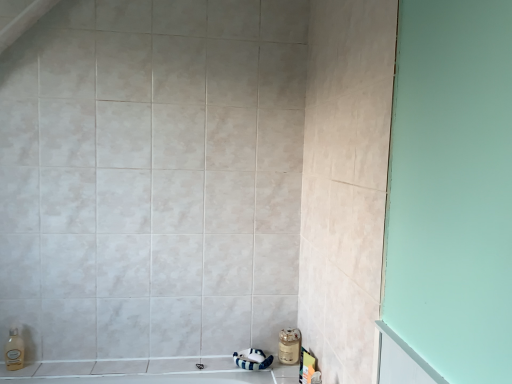
Question: Could you tell me if metallic gold jar at lower right is facing translucent plastic soap dispenser at lower left?

Choices:
 (A) yes
 (B) no

Answer: (B)

Question: Would you consider metallic gold jar at lower right to be distant from translucent plastic soap dispenser at lower left?

Choices:
 (A) no
 (B) yes

Answer: (B)

Question: Is metallic gold jar at lower right surrounding translucent plastic soap dispenser at lower left?

Choices:
 (A) yes
 (B) no

Answer: (B)

Question: From the image's perspective, does metallic gold jar at lower right appear lower than translucent plastic soap dispenser at lower left?

Choices:
 (A) yes
 (B) no

Answer: (A)

Question: Is metallic gold jar at lower right bigger than translucent plastic soap dispenser at lower left?

Choices:
 (A) yes
 (B) no

Answer: (A)

Question: Can you confirm if metallic gold jar at lower right is positioned to the right of translucent plastic soap dispenser at lower left?

Choices:
 (A) yes
 (B) no

Answer: (A)

Question: Considering the relative sizes of translucent plastic soap dispenser at lower left and metallic gold jar at lower right in the image provided, is translucent plastic soap dispenser at lower left wider than metallic gold jar at lower right?

Choices:
 (A) no
 (B) yes

Answer: (A)

Question: Is translucent plastic soap dispenser at lower left thinner than metallic gold jar at lower right?

Choices:
 (A) no
 (B) yes

Answer: (B)

Question: Is metallic gold jar at lower right at the back of translucent plastic soap dispenser at lower left?

Choices:
 (A) no
 (B) yes

Answer: (A)

Question: Does translucent plastic soap dispenser at lower left have a larger size compared to metallic gold jar at lower right?

Choices:
 (A) no
 (B) yes

Answer: (A)

Question: Is translucent plastic soap dispenser at lower left directly adjacent to metallic gold jar at lower right?

Choices:
 (A) no
 (B) yes

Answer: (A)

Question: Can you confirm if translucent plastic soap dispenser at lower left is smaller than metallic gold jar at lower right?

Choices:
 (A) yes
 (B) no

Answer: (A)

Question: Considering the relative positions of metallic gold jar at lower right and translucent plastic soap dispenser at lower left in the image provided, is metallic gold jar at lower right to the left or to the right of translucent plastic soap dispenser at lower left?

Choices:
 (A) left
 (B) right

Answer: (B)